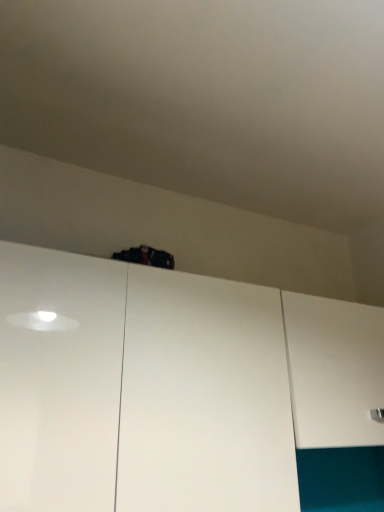
Question: Should I look upward or downward to see white matte cabinet at upper center, the second cabinetry in the right-to-left sequence?

Choices:
 (A) up
 (B) down

Answer: (B)

Question: Does white matte cabinet at upper center, the second cabinetry in the right-to-left sequence, appear on the left side of white matte cabinet at center, arranged as the first cabinetry when viewed from the right?

Choices:
 (A) no
 (B) yes

Answer: (B)

Question: From the image's perspective, is white matte cabinet at upper center, which is the 1th cabinetry from left to right, located beneath white matte cabinet at center, arranged as the first cabinetry when viewed from the right?

Choices:
 (A) no
 (B) yes

Answer: (A)

Question: Is white matte cabinet at upper center, the second cabinetry in the right-to-left sequence, positioned far away from white matte cabinet at center, which appears as the 2th cabinetry when viewed from the left?

Choices:
 (A) yes
 (B) no

Answer: (B)

Question: Is white matte cabinet at upper center, the second cabinetry in the right-to-left sequence, thinner than white matte cabinet at center, arranged as the first cabinetry when viewed from the right?

Choices:
 (A) yes
 (B) no

Answer: (A)

Question: From a real-world perspective, does white matte cabinet at upper center, the second cabinetry in the right-to-left sequence, stand above white matte cabinet at center, arranged as the first cabinetry when viewed from the right?

Choices:
 (A) yes
 (B) no

Answer: (B)

Question: Could you tell me if white matte cabinet at upper center, which is the 1th cabinetry from left to right, is turned towards white matte cabinet at center, which appears as the 2th cabinetry when viewed from the left?

Choices:
 (A) no
 (B) yes

Answer: (A)

Question: Is white matte cabinet at center, arranged as the first cabinetry when viewed from the right, thinner than white matte cabinet at upper center, which is the 1th cabinetry from left to right?

Choices:
 (A) no
 (B) yes

Answer: (A)

Question: Is white matte cabinet at center, arranged as the first cabinetry when viewed from the right, to the right of white matte cabinet at upper center, the second cabinetry in the right-to-left sequence, from the viewer's perspective?

Choices:
 (A) yes
 (B) no

Answer: (A)

Question: Is white matte cabinet at center, which appears as the 2th cabinetry when viewed from the left, positioned with its back to white matte cabinet at upper center, the second cabinetry in the right-to-left sequence?

Choices:
 (A) yes
 (B) no

Answer: (B)

Question: Is the surface of white matte cabinet at center, which appears as the 2th cabinetry when viewed from the left, in direct contact with white matte cabinet at upper center, the second cabinetry in the right-to-left sequence?

Choices:
 (A) no
 (B) yes

Answer: (A)

Question: Does white matte cabinet at center, arranged as the first cabinetry when viewed from the right, have a greater width compared to white matte cabinet at upper center, the second cabinetry in the right-to-left sequence?

Choices:
 (A) no
 (B) yes

Answer: (B)

Question: Would you consider white matte cabinet at center, arranged as the first cabinetry when viewed from the right, to be distant from white matte cabinet at upper center, the second cabinetry in the right-to-left sequence?

Choices:
 (A) no
 (B) yes

Answer: (A)

Question: Looking at the image, does white matte cabinet at upper center, the second cabinetry in the right-to-left sequence, seem bigger or smaller compared to white matte cabinet at center, arranged as the first cabinetry when viewed from the right?

Choices:
 (A) big
 (B) small

Answer: (A)